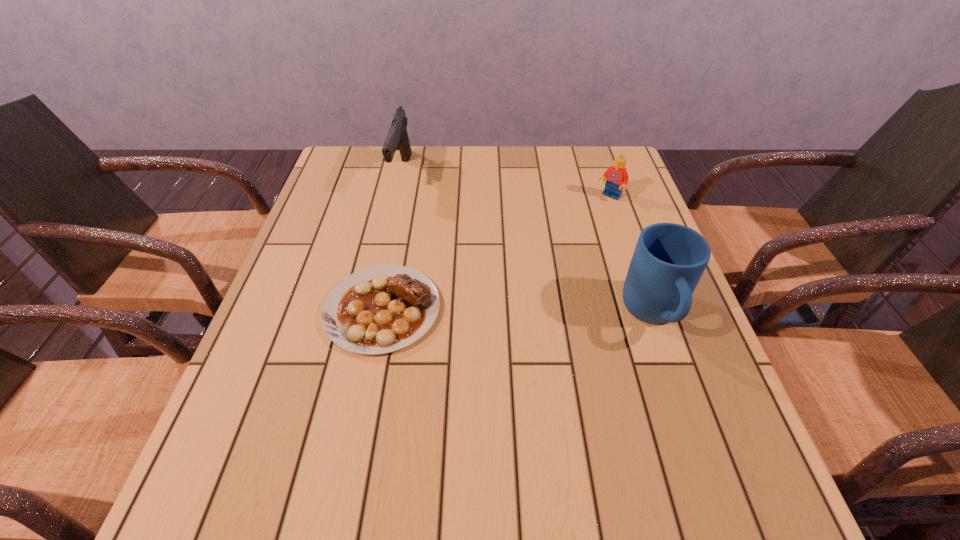
Where is `free point located 0.170m at the muzzle of the gun`? This screenshot has height=540, width=960. free point located 0.170m at the muzzle of the gun is located at coordinates (431, 227).

The image size is (960, 540). Find the location of `free location located 0.090m at the muzzle of the gun`. free location located 0.090m at the muzzle of the gun is located at coordinates 417,211.

The image size is (960, 540). What are the coordinates of `object that is at the far edge` in the screenshot? It's located at (397, 138).

Locate an element on the screen. object present at the left edge is located at coordinates (381, 309).

The width and height of the screenshot is (960, 540). In order to click on mug present at the right edge in this screenshot , I will do `click(669, 259)`.

Locate an element on the screen. This screenshot has width=960, height=540. Lego situated at the right edge is located at coordinates (616, 176).

I want to click on blank area at the far edge, so click(498, 174).

Find the location of a particular element. free spot at the left edge of the desktop is located at coordinates (332, 192).

Find the location of `free region at the right edge of the desktop`. free region at the right edge of the desktop is located at coordinates (626, 224).

This screenshot has width=960, height=540. In order to click on free space at the far left corner in this screenshot , I will do `click(325, 187)`.